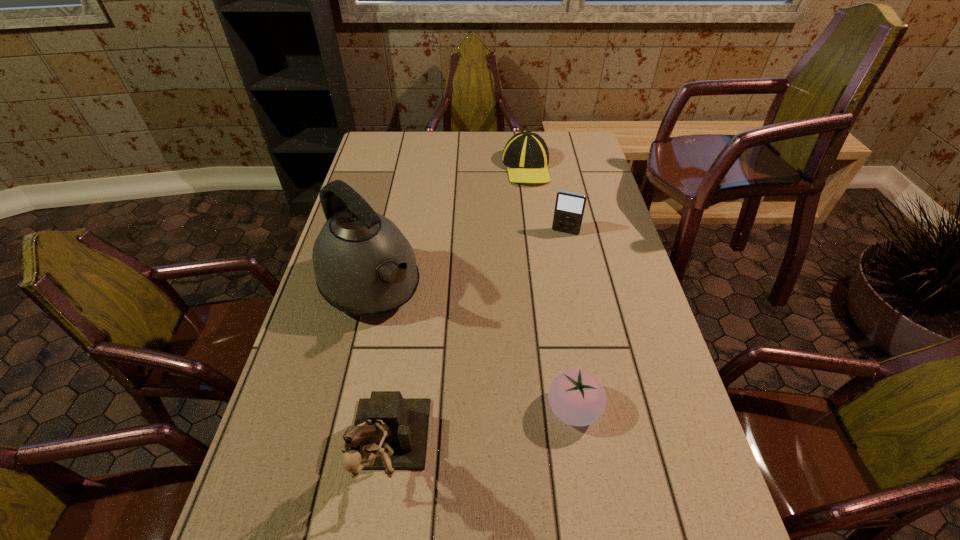
Find the location of `figurine`. figurine is located at coordinates pyautogui.click(x=390, y=432).

Locate an element on the screen. tomato is located at coordinates (577, 397).

Where is `iPod`? The height and width of the screenshot is (540, 960). iPod is located at coordinates (569, 208).

Where is `the second farthest object`? the second farthest object is located at coordinates (569, 208).

You are a GUI agent. You are given a task and a screenshot of the screen. Output one action in this format:
    pyautogui.click(x=<x>, y=<y>)
    Task: Click on the farthest object
    
    Given the screenshot: What is the action you would take?
    coord(526,156)

Locate an element on the screen. Image resolution: width=960 pixels, height=540 pixels. kettle is located at coordinates (363, 264).

The height and width of the screenshot is (540, 960). In order to click on vacant space located on the back of the tomato in this screenshot , I will do `click(566, 362)`.

Locate an element on the screen. free space located 0.230m on the front-facing side of the iPod is located at coordinates (546, 285).

This screenshot has width=960, height=540. I want to click on free location located 0.250m on the front-facing side of the iPod, so click(544, 290).

Locate an element on the screen. blank area located 0.230m on the front-facing side of the iPod is located at coordinates (546, 285).